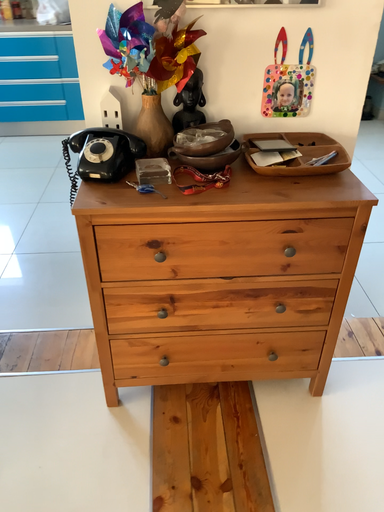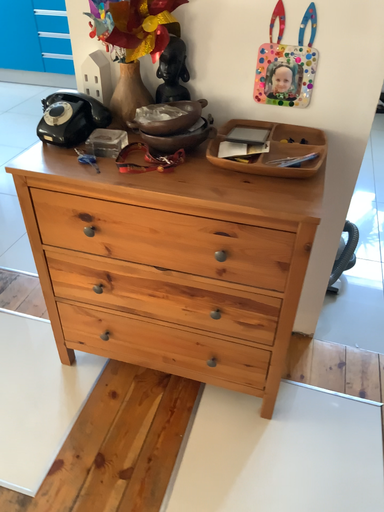
Question: How did the camera likely rotate when shooting the video?

Choices:
 (A) rotated left
 (B) rotated right

Answer: (A)